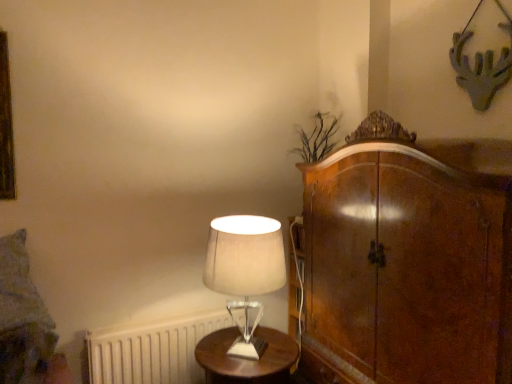
Where is `free space underneath white fabric lampshade at center (from a real-world perspective)`? This screenshot has height=384, width=512. free space underneath white fabric lampshade at center (from a real-world perspective) is located at coordinates coord(248,346).